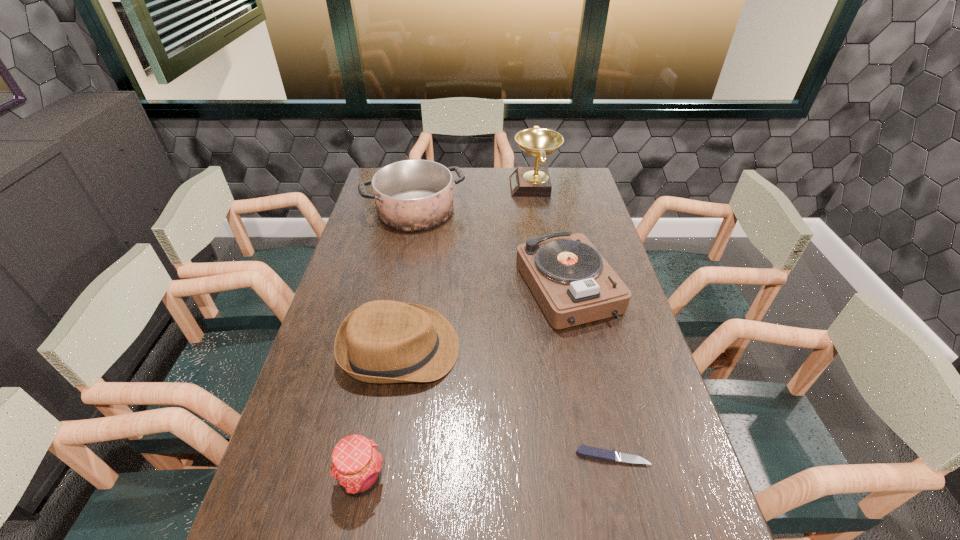
Where is `award`? The height and width of the screenshot is (540, 960). award is located at coordinates (535, 181).

Locate an element on the screen. The width and height of the screenshot is (960, 540). saucepan is located at coordinates (412, 195).

Image resolution: width=960 pixels, height=540 pixels. I want to click on record player, so click(573, 284).

This screenshot has height=540, width=960. In order to click on fedora in this screenshot , I will do `click(383, 341)`.

Locate an element on the screen. The height and width of the screenshot is (540, 960). jam is located at coordinates (356, 466).

The width and height of the screenshot is (960, 540). In order to click on the shortest object in this screenshot , I will do [595, 453].

This screenshot has height=540, width=960. In order to click on vacant space located 0.150m on the front-facing side of the award in this screenshot , I will do `click(475, 187)`.

Identify the location of vacant region located on the front-facing side of the award. (456, 187).

Where is `free space located 0.120m on the front-facing side of the award`? free space located 0.120m on the front-facing side of the award is located at coordinates (482, 187).

Image resolution: width=960 pixels, height=540 pixels. I want to click on free point located on the back of the fifth shortest object, so click(x=422, y=178).